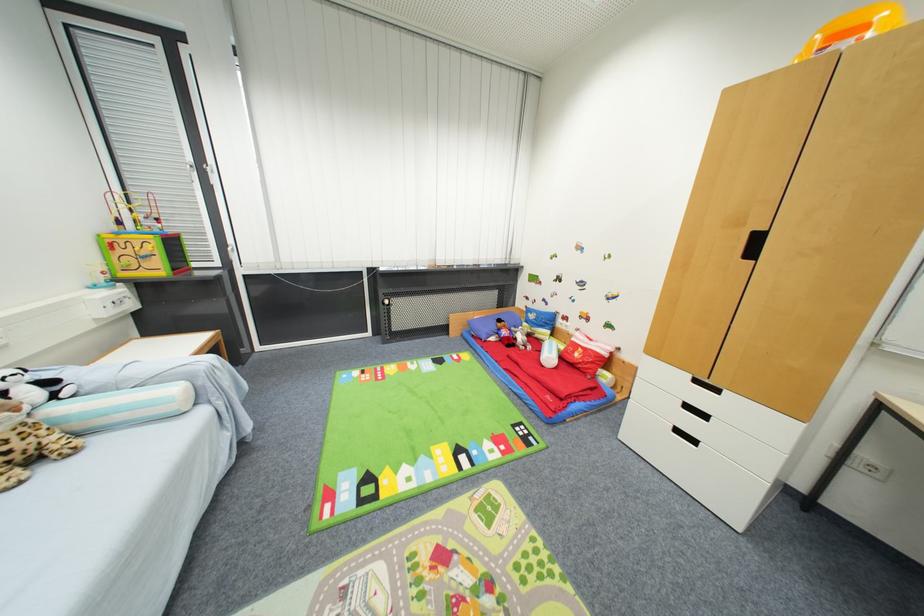
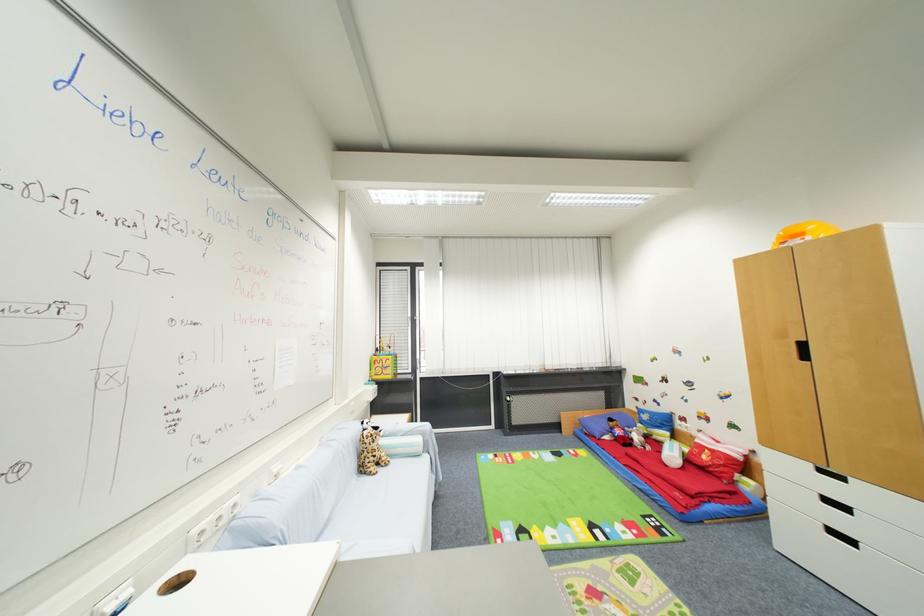
Where in the second image is the point corresponding to pixel 541 338 from the first image?

(660, 439)